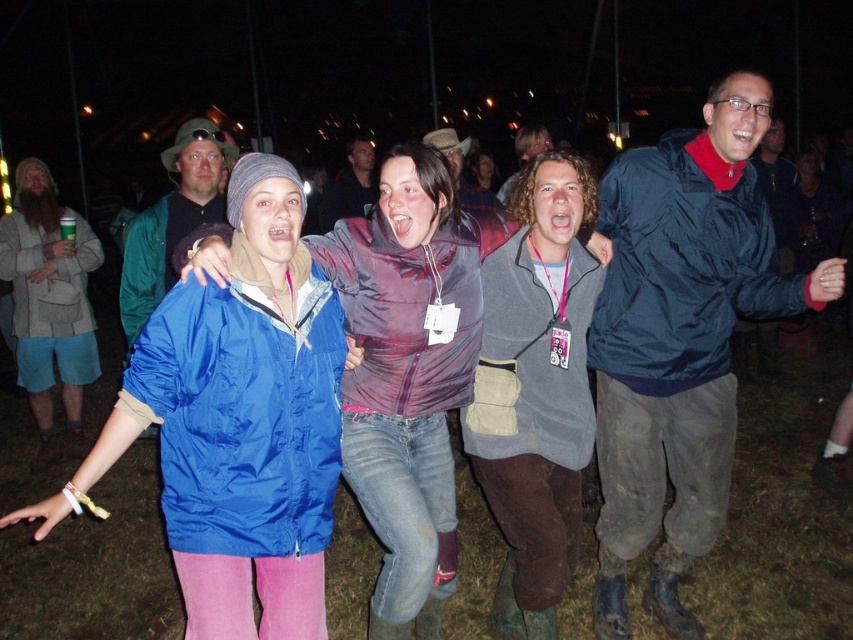
Does matte blue jacket at center have a smaller size compared to beige textured jacket at left?

Correct, matte blue jacket at center occupies less space than beige textured jacket at left.

Between matte blue jacket at center and beige textured jacket at left, which one appears on the right side from the viewer's perspective?

Positioned to the right is matte blue jacket at center.

Which is in front, point (216, 616) or point (44, 428)?

Point (216, 616) is in front.

This screenshot has height=640, width=853. I want to click on matte blue jacket at center, so click(238, 422).

Which is behind, point (444, 486) or point (344, 182)?

The point (344, 182) is more distant.

Is blue nylon jacket at center closer to camera compared to matte purple shirt at center?

Yes.

Looking at this image, who is more distant from viewer, (352,472) or (360,150)?

Point (360,150)

Where is `blue nylon jacket at center`? Image resolution: width=853 pixels, height=640 pixels. blue nylon jacket at center is located at coordinates (408, 371).

Which of these two, blue nylon jacket at center or matte green jacket at center, stands shorter?

With less height is matte green jacket at center.

Between point (386, 353) and point (196, 196), which one is positioned in front?

Point (386, 353)

Measure the distance between blue nylon jacket at center and camera.

blue nylon jacket at center and camera are 7.83 feet apart from each other.

Locate an element on the screen. blue nylon jacket at center is located at coordinates (408, 371).